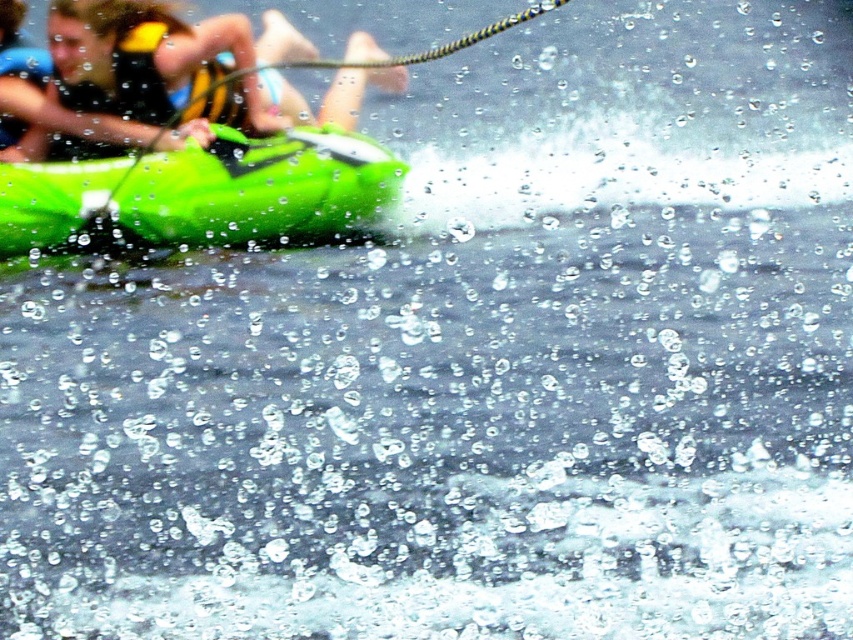
Which is more to the right, green matte kayak at left or yellow life vest at upper left?

From the viewer's perspective, green matte kayak at left appears more on the right side.

Measure the distance between green matte kayak at left and camera.

green matte kayak at left and camera are 16.33 meters apart from each other.

Locate an element on the screen. green matte kayak at left is located at coordinates (202, 193).

This screenshot has width=853, height=640. What are the coordinates of `green matte kayak at left` in the screenshot? It's located at (202, 193).